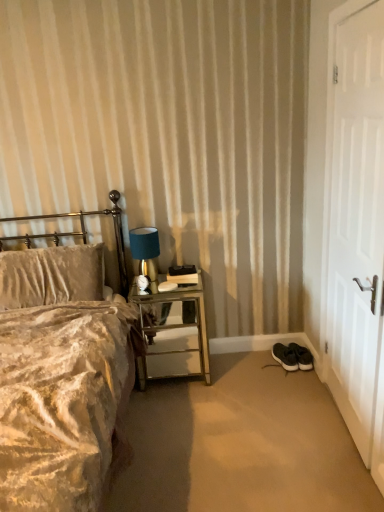
This screenshot has height=512, width=384. Find the location of `empty space that is ontop of black fabric shoes at lower right (from a real-world perspective)`. empty space that is ontop of black fabric shoes at lower right (from a real-world perspective) is located at coordinates (238, 426).